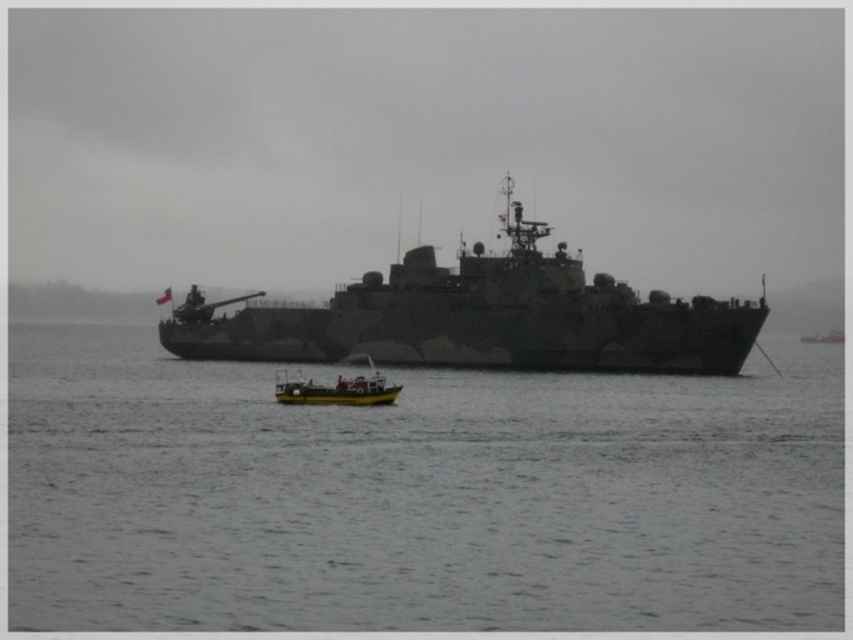
Is point (519, 202) farther from camera compared to point (337, 380)?

Yes, point (519, 202) is farther from viewer.

Is camouflage matte ship at center positioned at the back of yellow matte boat at center?

That is True.

Between point (738, 328) and point (331, 388), which one is positioned in front?

Point (331, 388) is more forward.

In order to click on camouflage matte ship at center in this screenshot , I will do `click(480, 317)`.

Is gray matte water at center wider than yellow matte boat at center?

Correct, the width of gray matte water at center exceeds that of yellow matte boat at center.

The image size is (853, 640). I want to click on gray matte water at center, so click(x=416, y=496).

What do you see at coordinates (416, 496) in the screenshot?
I see `gray matte water at center` at bounding box center [416, 496].

The image size is (853, 640). I want to click on gray matte water at center, so coord(416,496).

Is point (345, 589) closer to camera compared to point (387, 291)?

Yes, point (345, 589) is in front of point (387, 291).

Can you confirm if gray matte water at center is positioned to the right of camouflage matte ship at center?

No, gray matte water at center is not to the right of camouflage matte ship at center.

Between point (288, 412) and point (368, 288), which one is positioned behind?

Positioned behind is point (368, 288).

The image size is (853, 640). Find the location of `gray matte water at center`. gray matte water at center is located at coordinates (416, 496).